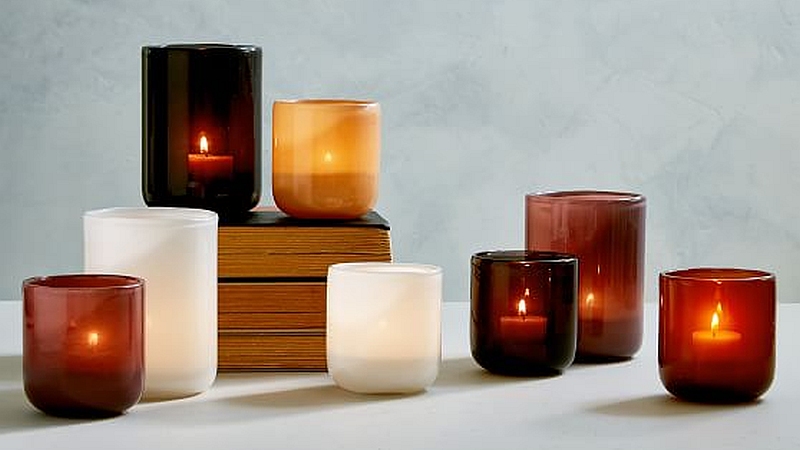
You are a GUI agent. You are given a task and a screenshot of the screen. Output one action in this format:
    pyautogui.click(x=<x>, y=<y>)
    Task: Click on the candle flame
    The width and height of the screenshot is (800, 450).
    Given the screenshot: What is the action you would take?
    pyautogui.click(x=92, y=337), pyautogui.click(x=208, y=139), pyautogui.click(x=518, y=315), pyautogui.click(x=586, y=296), pyautogui.click(x=716, y=322), pyautogui.click(x=325, y=156)